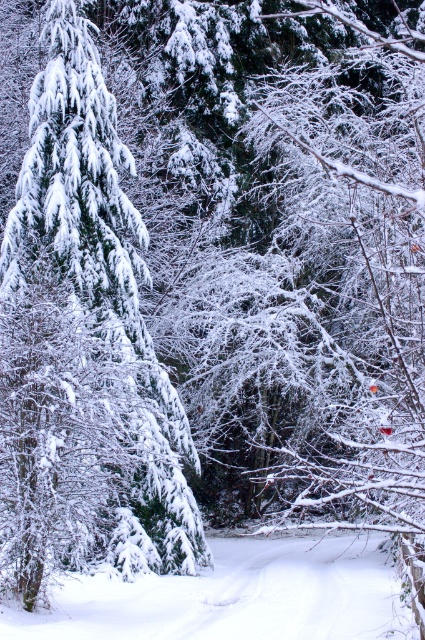
You are an explorer in the winter forest. You see a green matte tree at left and a white fluffy snow at center. Which object is larger in size?

The green matte tree at left is bigger than the white fluffy snow at center.

You are standing in the winter forest scene. You want to walk from the green matte tree at left to the white fluffy snow at center. Which direction should you move relative to the tree?

You should move towards the center of the scene away from the green matte tree at left, since the white fluffy snow at center is farther away from the viewer than the tree.